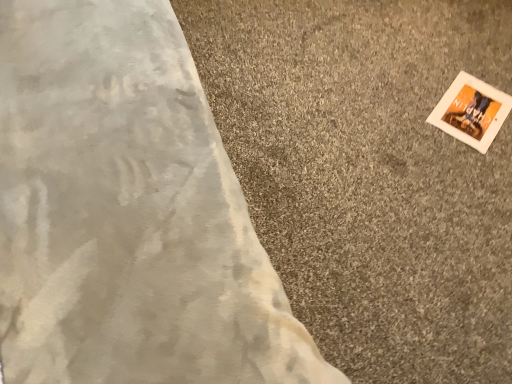
In order to face white soft carpet at upper right, should I rotate leftwards or rightwards?

To face it directly, rotate right by 21.581 degrees.

What do you see at coordinates (370, 174) in the screenshot?
I see `white soft carpet at upper right` at bounding box center [370, 174].

Locate an element on the screen. white soft carpet at upper right is located at coordinates (370, 174).

This screenshot has width=512, height=384. What are the coordinates of `white matte picture frame at upper right` in the screenshot? It's located at (471, 111).

In order to face white matte picture frame at upper right, should I rotate leftwards or rightwards?

You should look right and rotate roughly 26.829 degrees.

Measure the distance between point (496,118) and camera.

Point (496,118) is 4.69 feet from camera.

What do you see at coordinates (471, 111) in the screenshot?
I see `white matte picture frame at upper right` at bounding box center [471, 111].

At what (x,y) coordinates should I click in order to perform the action: click on white soft carpet at upper right. Please return your answer as a coordinate pair (x, y). The height and width of the screenshot is (384, 512). Looking at the image, I should click on (370, 174).

Would you say white soft carpet at upper right is to the left or to the right of white matte picture frame at upper right in the picture?

white soft carpet at upper right is positioned on white matte picture frame at upper right's left side.

Who is more distant, white soft carpet at upper right or white matte picture frame at upper right?

Positioned behind is white matte picture frame at upper right.

Considering the points (436, 97) and (452, 92), which point is behind, point (436, 97) or point (452, 92)?

The point (452, 92) is farther.

From the image's perspective, which is below, white soft carpet at upper right or white matte picture frame at upper right?

white soft carpet at upper right is shown below in the image.

From a real-world perspective, is white soft carpet at upper right physically above white matte picture frame at upper right?

No, from a real-world perspective, white soft carpet at upper right is not above white matte picture frame at upper right.

Considering the relative sizes of white soft carpet at upper right and white matte picture frame at upper right in the image provided, is white soft carpet at upper right thinner than white matte picture frame at upper right?

In fact, white soft carpet at upper right might be wider than white matte picture frame at upper right.

Which of these two, white soft carpet at upper right or white matte picture frame at upper right, stands taller?

Standing taller between the two is white soft carpet at upper right.

Is white soft carpet at upper right smaller than white matte picture frame at upper right?

Incorrect, white soft carpet at upper right is not smaller in size than white matte picture frame at upper right.

Can white matte picture frame at upper right be found inside white soft carpet at upper right?

Yes.

Is white soft carpet at upper right touching white matte picture frame at upper right?

No, white soft carpet at upper right is not touching white matte picture frame at upper right.

Is white soft carpet at upper right aimed at white matte picture frame at upper right?

No, white soft carpet at upper right is not facing towards white matte picture frame at upper right.

How different are the orientations of white soft carpet at upper right and white matte picture frame at upper right in degrees?

The angle between the facing direction of white soft carpet at upper right and the facing direction of white matte picture frame at upper right is 33 degrees.

How distant is white soft carpet at upper right from white matte picture frame at upper right?

white soft carpet at upper right is 12.06 inches away from white matte picture frame at upper right.

This screenshot has height=384, width=512. What are the coordinates of `concrete lying below the white matte picture frame at upper right (from the image's perspective)` in the screenshot? It's located at (370, 174).

Is white matte picture frame at upper right to the right of white soft carpet at upper right from the viewer's perspective?

Yes.

Is the depth of white matte picture frame at upper right less than that of white soft carpet at upper right?

No, it is not.

Is point (470, 76) closer to viewer compared to point (323, 335)?

No.

From the image's perspective, is white matte picture frame at upper right below white soft carpet at upper right?

No, from the image's perspective, white matte picture frame at upper right is not below white soft carpet at upper right.

From a real-world perspective, between white matte picture frame at upper right and white soft carpet at upper right, who is vertically lower?

From a 3D spatial view, white soft carpet at upper right is below.

Based on the photo, which of these two, white matte picture frame at upper right or white soft carpet at upper right, is thinner?

With smaller width is white matte picture frame at upper right.

Who is taller, white matte picture frame at upper right or white soft carpet at upper right?

white soft carpet at upper right.

In terms of size, does white matte picture frame at upper right appear bigger or smaller than white soft carpet at upper right?

Considering their sizes, white matte picture frame at upper right takes up less space than white soft carpet at upper right.

Is white soft carpet at upper right completely or partially inside white matte picture frame at upper right?

No, white matte picture frame at upper right does not contain white soft carpet at upper right.

Is white matte picture frame at upper right far away from white soft carpet at upper right?

No.

Is white matte picture frame at upper right turned away from white soft carpet at upper right?

Yes, white matte picture frame at upper right is positioned with its back facing white soft carpet at upper right.

How different are the orientations of white matte picture frame at upper right and white soft carpet at upper right in degrees?

There is a 33-degree angle between the facing directions of white matte picture frame at upper right and white soft carpet at upper right.

How far apart are white matte picture frame at upper right and white soft carpet at upper right?

white matte picture frame at upper right is 12.06 inches away from white soft carpet at upper right.

Where is `concrete below the white matte picture frame at upper right (from the image's perspective)`? Image resolution: width=512 pixels, height=384 pixels. concrete below the white matte picture frame at upper right (from the image's perspective) is located at coordinates (370, 174).

Locate an element on the screen. This screenshot has width=512, height=384. concrete on the left side of white matte picture frame at upper right is located at coordinates point(370,174).

You are a GUI agent. You are given a task and a screenshot of the screen. Output one action in this format:
    pyautogui.click(x=<x>, y=<y>)
    Task: Click on the picture frame on the right of white soft carpet at upper right
    
    Given the screenshot: What is the action you would take?
    pyautogui.click(x=471, y=111)